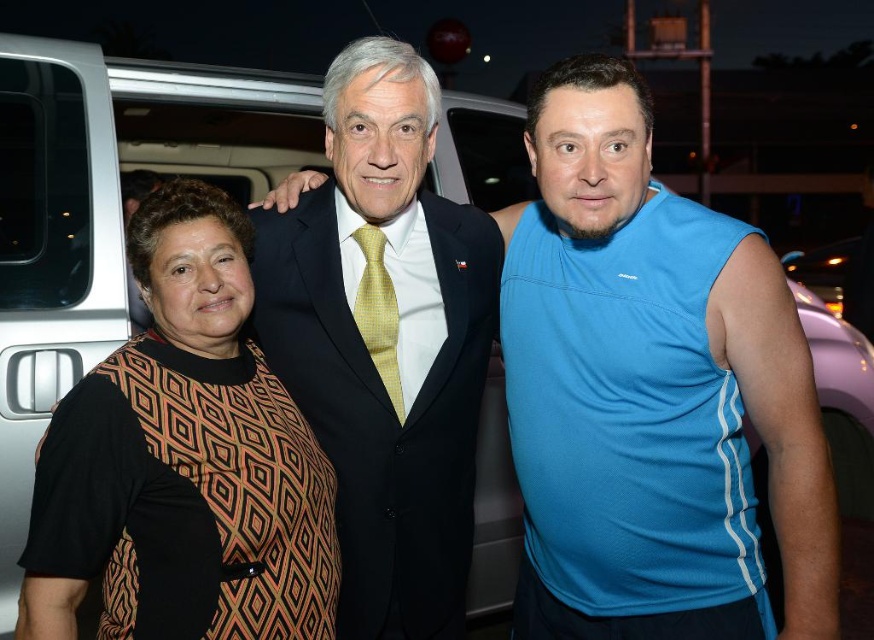
Question: Among these points, which one is nearest to the camera?

Choices:
 (A) (248, 525)
 (B) (390, 243)
 (C) (780, 500)

Answer: (A)

Question: Is patterned fabric dress at left positioned behind matte black suit at center?

Choices:
 (A) yes
 (B) no

Answer: (B)

Question: Which of the following is the closest to the observer?

Choices:
 (A) blue mesh tank top at center
 (B) patterned fabric dress at left

Answer: (B)

Question: Observing the image, what is the correct spatial positioning of patterned fabric dress at left in reference to matte black suit at center?

Choices:
 (A) above
 (B) below

Answer: (B)

Question: Which object appears closest to the camera in this image?

Choices:
 (A) matte black suit at center
 (B) blue mesh tank top at center

Answer: (B)

Question: Can you confirm if blue mesh tank top at center is wider than matte black suit at center?

Choices:
 (A) no
 (B) yes

Answer: (A)